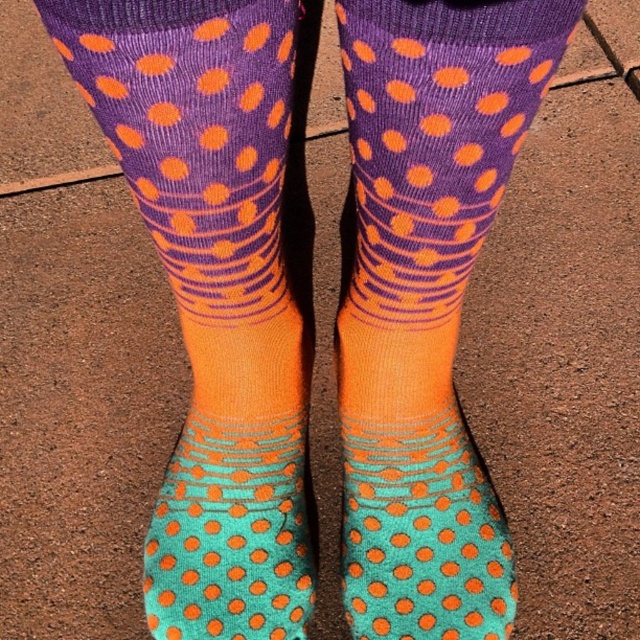
Which is above, matte purple socks at center or teal dotted socks at center?

matte purple socks at center

Is point (355, 291) farther from camera compared to point (200, 611)?

Yes, it is.

Locate an element on the screen. matte purple socks at center is located at coordinates (426, 298).

Who is positioned more to the left, orange dotted socks at center or matte purple socks at center?

orange dotted socks at center is more to the left.

Does orange dotted socks at center have a smaller size compared to matte purple socks at center?

Yes.

You are a GUI agent. You are given a task and a screenshot of the screen. Output one action in this format:
    pyautogui.click(x=<x>, y=<y>)
    Task: Click on the orange dotted socks at center
    
    Given the screenshot: What is the action you would take?
    pyautogui.click(x=212, y=292)

Between teal matte socks at center and teal dotted socks at center, which one is positioned higher?

Positioned higher is teal matte socks at center.

Does teal matte socks at center come behind teal dotted socks at center?

No, teal matte socks at center is in front of teal dotted socks at center.

Identify the location of teal matte socks at center. (422, 534).